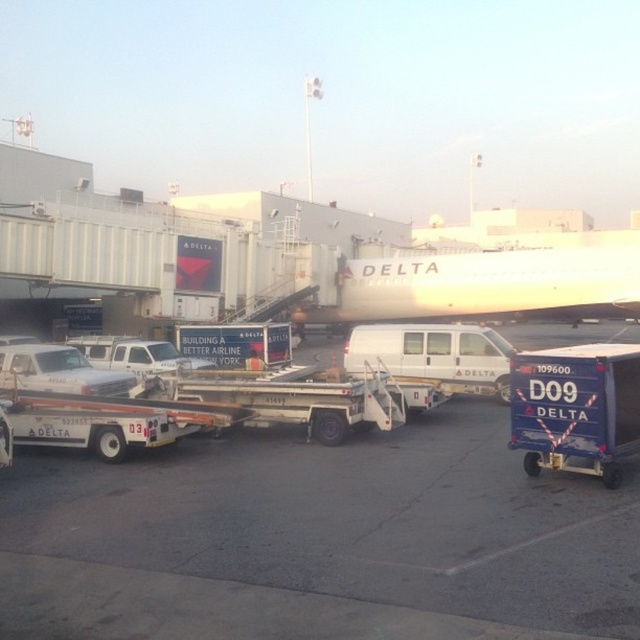
The image size is (640, 640). What do you see at coordinates (317, 540) in the screenshot?
I see `white asphalt tarmac at center` at bounding box center [317, 540].

Who is more forward, (490, 612) or (620, 275)?

Point (490, 612) is in front.

At what (x,y) coordinates should I click in order to perform the action: click on white asphalt tarmac at center. Please return your answer as a coordinate pair (x, y). The image size is (640, 640). Looking at the image, I should click on (317, 540).